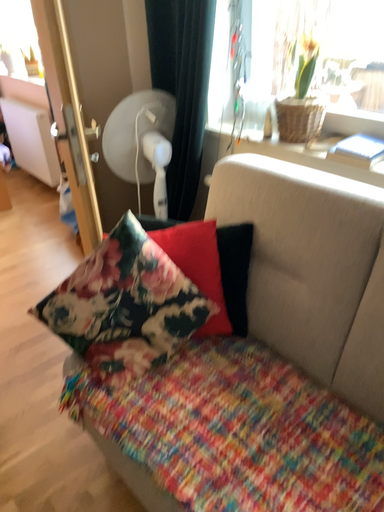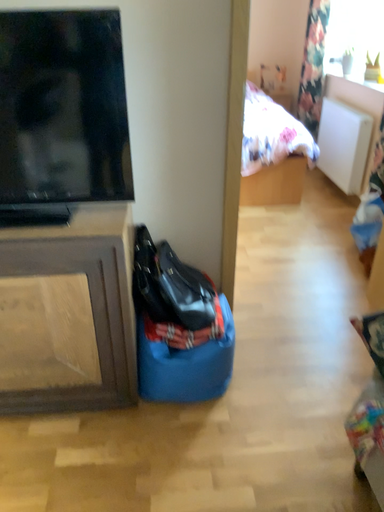
Question: How did the camera likely rotate when shooting the video?

Choices:
 (A) rotated left
 (B) rotated right

Answer: (A)